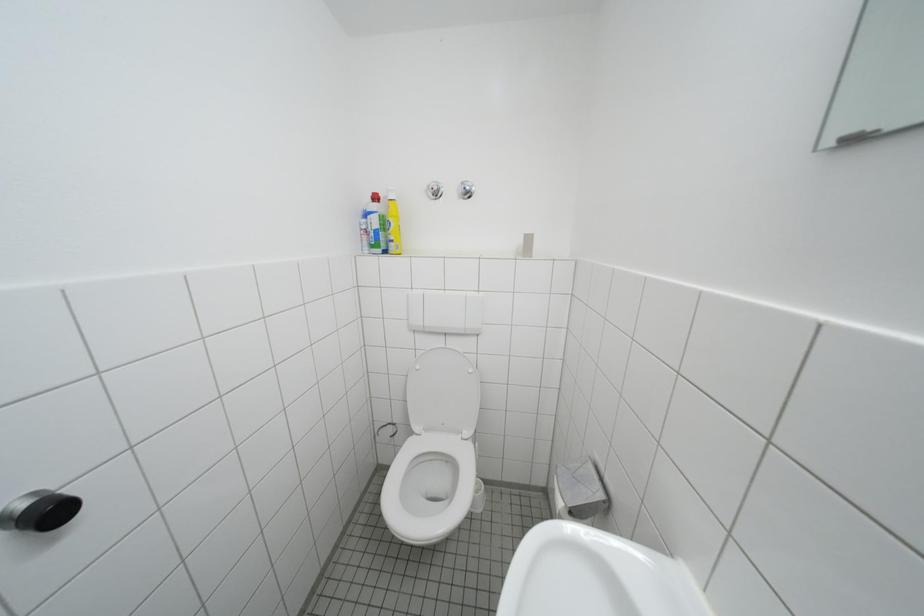
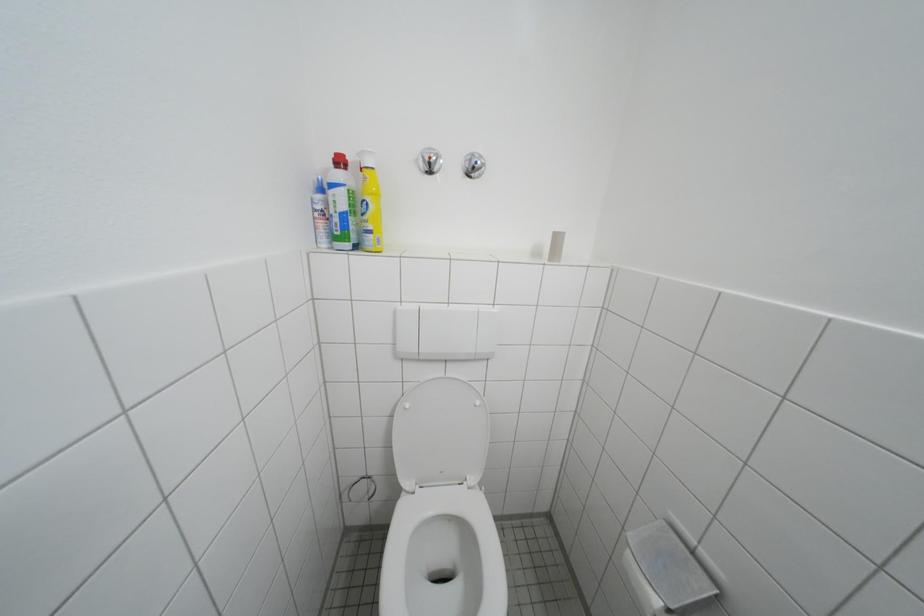
Question: The first image is from the beginning of the video and the second image is from the end. How did the camera likely rotate when shooting the video?

Choices:
 (A) Left
 (B) Right
 (C) Up
 (D) Down

Answer: (B)